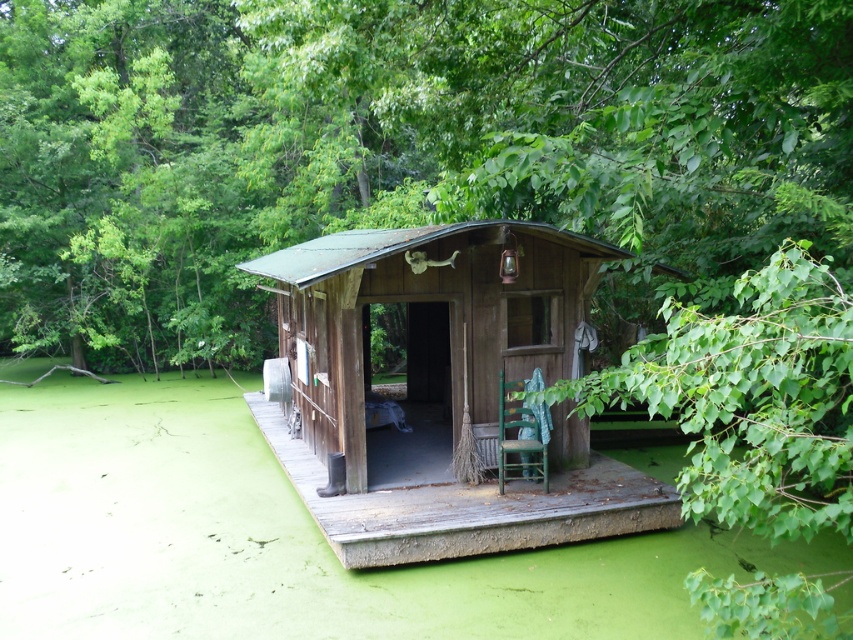
Question: Considering the real-world distances, which object is closest to the rustic wood cabin at center?

Choices:
 (A) green wooden chair at center
 (B) green leafy tree at center

Answer: (A)

Question: Is green leafy tree at center wider than rustic wood cabin at center?

Choices:
 (A) yes
 (B) no

Answer: (A)

Question: Which point is farther to the camera?

Choices:
 (A) (113, 289)
 (B) (392, 243)
 (C) (541, 448)

Answer: (A)

Question: Which point is closer to the camera taking this photo?

Choices:
 (A) (518, 426)
 (B) (320, 528)
 (C) (814, 6)

Answer: (C)

Question: Is green leafy tree at center below rustic wood cabin at center?

Choices:
 (A) yes
 (B) no

Answer: (B)

Question: From the image, what is the correct spatial relationship of green leafy tree at center in relation to rustic wood cabin at center?

Choices:
 (A) left
 (B) right

Answer: (A)